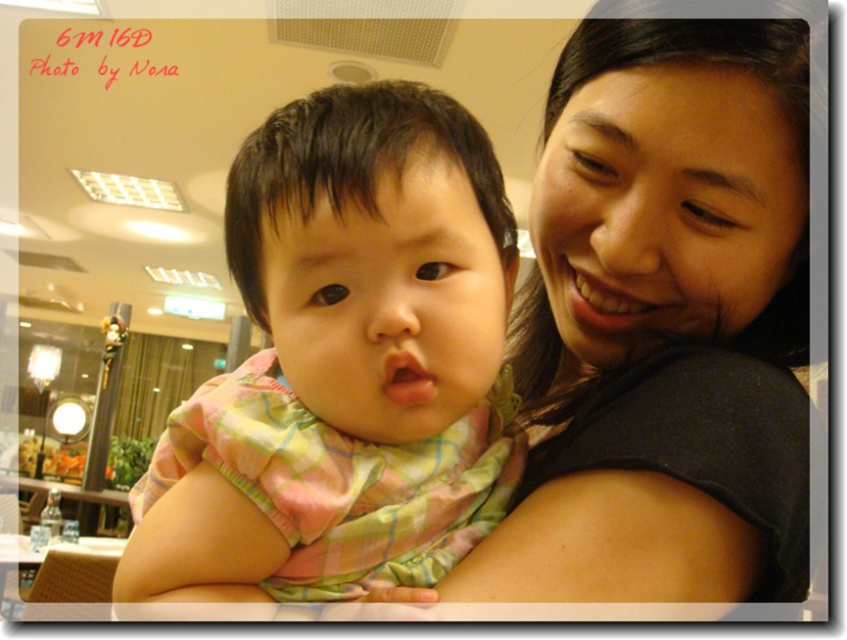
You are trying to decide which shirt to place on a small hanger. The hanger can only hold items up to 15 inches in height. Given the matte black shirt at center and the pink plaid shirt at center, which shirt is more likely to fit on the hanger?

The pink plaid shirt at center is shorter than the matte black shirt at center, so the pink plaid shirt at center is more likely to fit on the hanger since it is shorter and under the 15 inches height limit.

You are a photographer adjusting your camera settings. You need to focus on the matte black shirt at center. What coordinates should you set your camera to focus on?

The coordinates for the matte black shirt at center are at point [662,324], so you should set your camera focus to those coordinates.

You are a photographer setting up for a portrait. You see the matte black shirt at center and the pink plaid shirt at center in the scene. Which shirt is positioned to the right side of the other?

The matte black shirt at center is to the right of the pink plaid shirt at center.